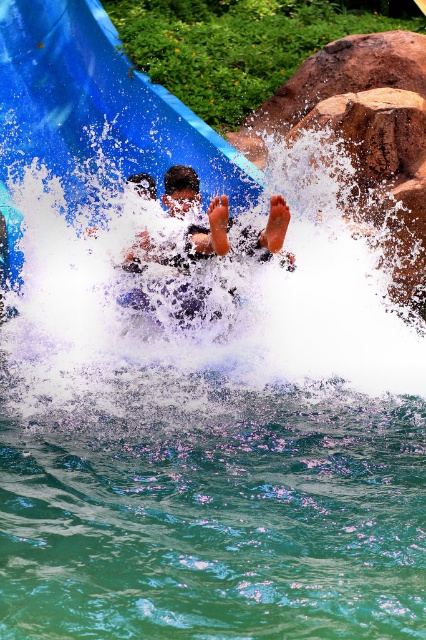
Question: Is blue plastic slide at upper left wider than smooth skin person at center?

Choices:
 (A) yes
 (B) no

Answer: (B)

Question: Considering the relative positions of blue plastic slide at upper left and smooth skin person at center in the image provided, where is blue plastic slide at upper left located with respect to smooth skin person at center?

Choices:
 (A) left
 (B) right

Answer: (B)

Question: Which object is farther from the camera taking this photo?

Choices:
 (A) blue plastic slide at upper left
 (B) smooth skin person at center

Answer: (A)

Question: Which object is farther from the camera taking this photo?

Choices:
 (A) smooth skin person at center
 (B) blue plastic slide at upper left

Answer: (B)

Question: Can you confirm if blue plastic slide at upper left is positioned to the left of smooth skin person at center?

Choices:
 (A) yes
 (B) no

Answer: (B)

Question: Which object appears closest to the camera in this image?

Choices:
 (A) blue plastic slide at upper left
 (B) smooth skin person at center

Answer: (B)